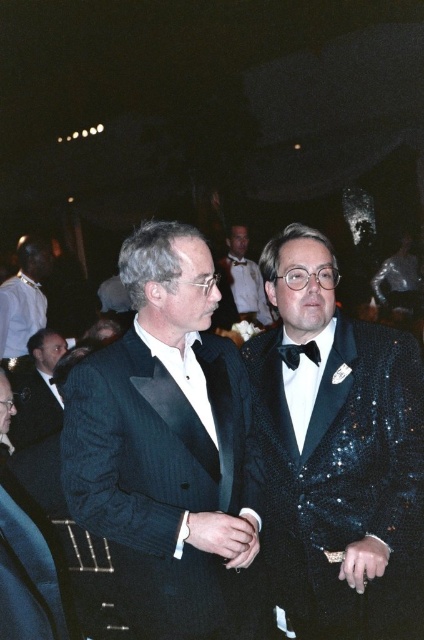
You are a photographer at the event and need to capture a photo where both the shiny black tuxedo at center and the shiny black bow tie at center are clearly visible. Given their heights, which one might require adjusting the camera angle to ensure it doesn

The shiny black tuxedo at center is shorter than the shiny black bow tie at center. To capture both clearly, you may need to lower the camera angle slightly to ensure the taller shiny black bow tie at center is fully in frame while still showing the shorter shiny black tuxedo at center.

You are a photographer at a formal event. You want to take a photo of both the sequined tuxedo at center and the white shirt at upper left. Can you capture both in the same frame without any obstruction?

Yes, the sequined tuxedo at center is in front of the white shirt at upper left, so both can be captured in the same frame as the sequined tuxedo at center is not blocking the white shirt at upper left completely.

You are a photographer at a formal event. You need to capture a closeup shot of the black satin bow tie at center without including the shiny black tuxedo at center in the frame. Is this possible given their positions?

The shiny black tuxedo at center is positioned on the left side of black satin bow tie at center. Since the tuxedo is to the left of the bow tie, you can adjust your camera angle to focus solely on the black satin bow tie at center by moving to the right side of the bow tie, ensuring the tuxedo is out of frame.